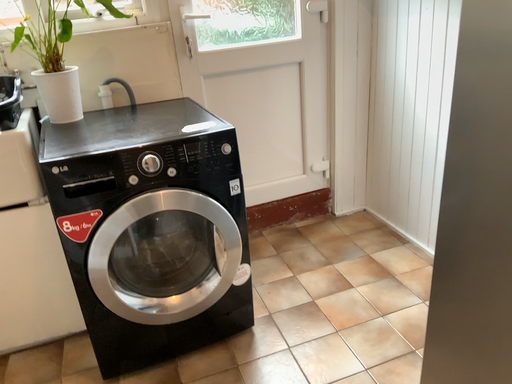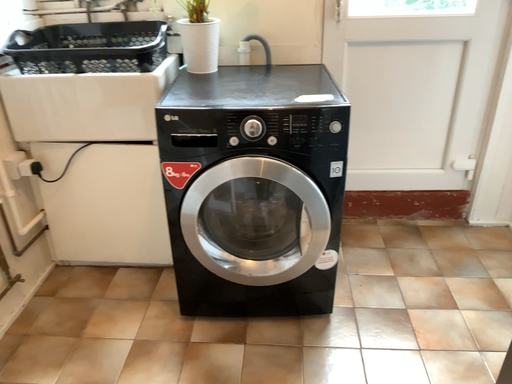
Question: How did the camera likely rotate when shooting the video?

Choices:
 (A) rotated left
 (B) rotated right

Answer: (A)